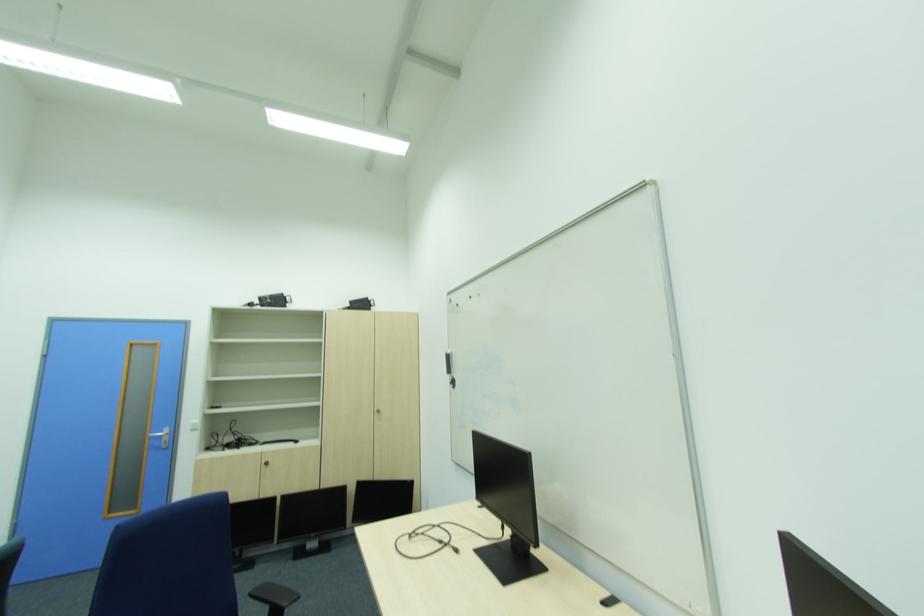
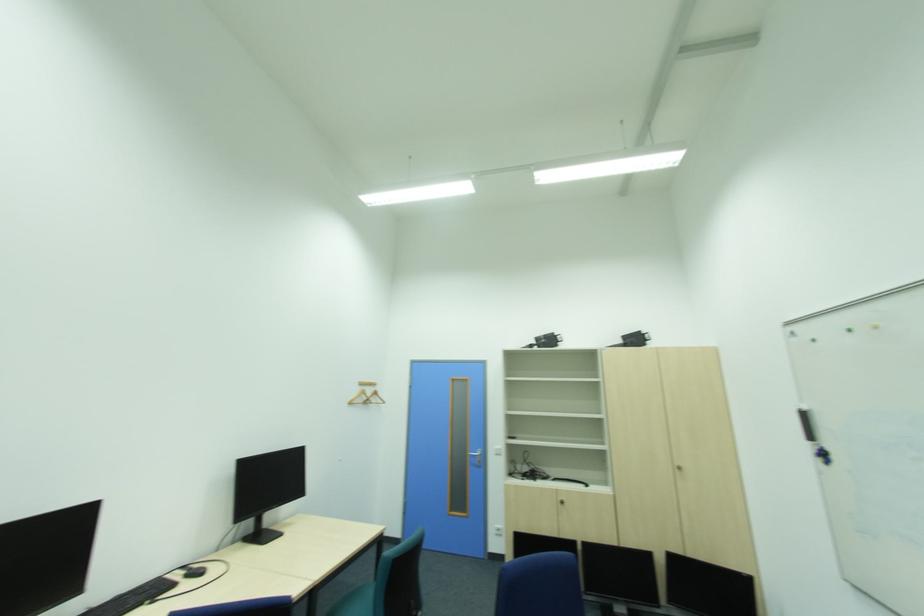
Question: The camera is either moving clockwise (left) or counter-clockwise (right) around the object. The first image is from the beginning of the video and the second image is from the end. Is the camera moving left or right when shooting the video?

Choices:
 (A) Left
 (B) Right

Answer: (B)